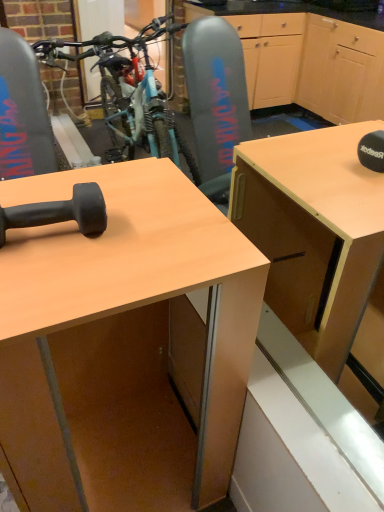
Image resolution: width=384 pixels, height=512 pixels. What are the coordinates of `empty space that is ontop of matte wood desk at center (from a real-world perspective)` in the screenshot? It's located at (92, 232).